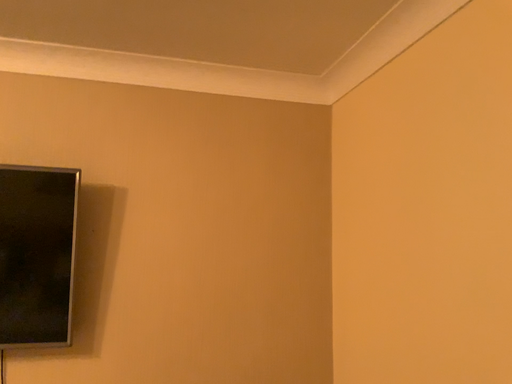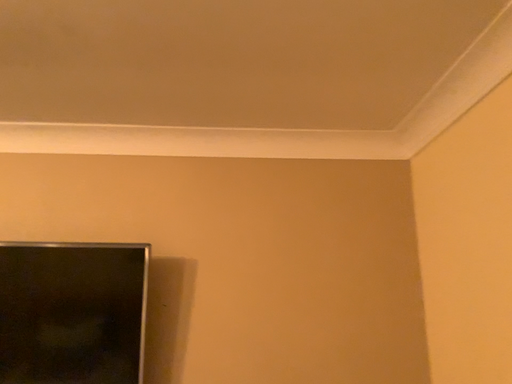
Question: How did the camera likely rotate when shooting the video?

Choices:
 (A) rotated left
 (B) rotated right

Answer: (A)